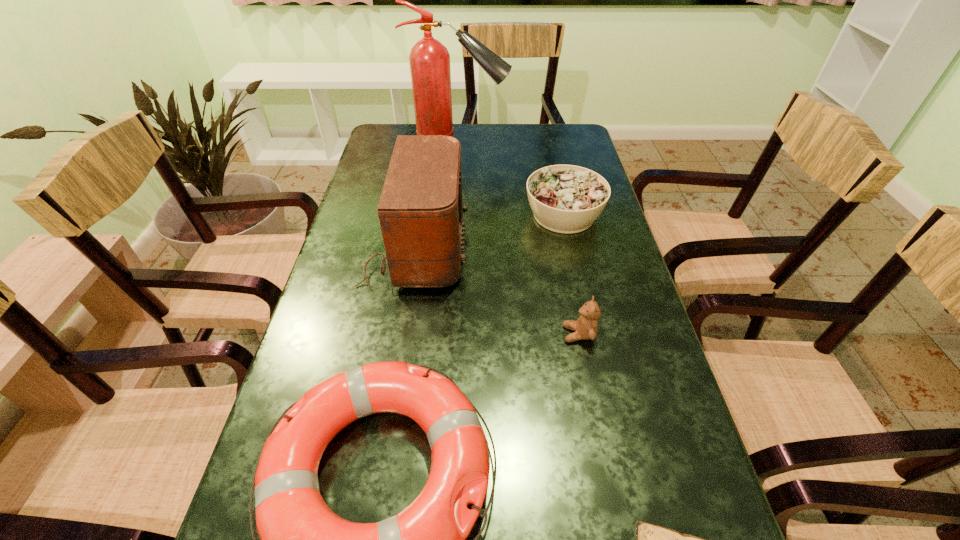
Find the location of `free space located on the face of the fourth farthest object`. free space located on the face of the fourth farthest object is located at coordinates click(x=420, y=334).

Identify the location of object present at the far edge. The width and height of the screenshot is (960, 540). (429, 59).

Where is `fire extinguisher at the left edge`? fire extinguisher at the left edge is located at coordinates (429, 59).

The width and height of the screenshot is (960, 540). What are the coordinates of `radio receiver located in the left edge section of the desktop` in the screenshot? It's located at (420, 210).

Where is `salad that is at the right edge`? The width and height of the screenshot is (960, 540). salad that is at the right edge is located at coordinates (567, 199).

Locate an element on the screen. teddy bear that is at the right edge is located at coordinates (586, 327).

You are a GUI agent. You are given a task and a screenshot of the screen. Output one action in this format:
    pyautogui.click(x=<x>, y=<y>)
    Task: Click on the object situated at the far left corner
    The width and height of the screenshot is (960, 540).
    Given the screenshot: What is the action you would take?
    pyautogui.click(x=429, y=59)

This screenshot has height=540, width=960. I want to click on free spot at the far edge of the desktop, so click(x=516, y=127).

What are the coordinates of `vacant area at the left edge of the desktop` in the screenshot? It's located at (354, 233).

The image size is (960, 540). I want to click on free space at the right edge of the desktop, so point(610,228).